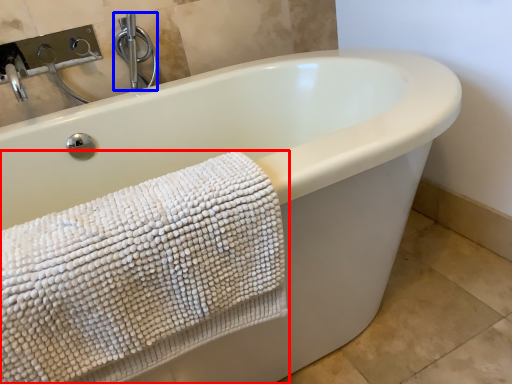
Question: Which point is further to the camera, towel (highlighted by a red box) or faucet (highlighted by a blue box)?

Choices:
 (A) towel
 (B) faucet

Answer: (B)